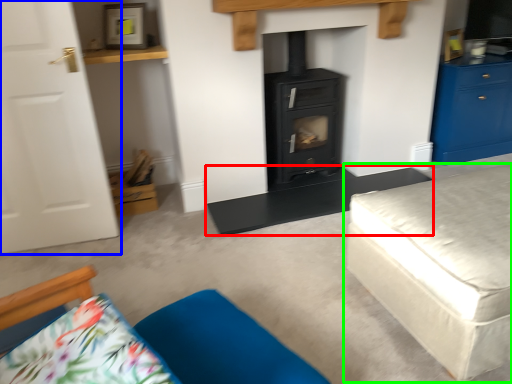
Question: Which object is positioned farthest from table (highlighted by a red box)? Select from door (highlighted by a blue box) and studio couch (highlighted by a green box).

Choices:
 (A) door
 (B) studio couch

Answer: (A)